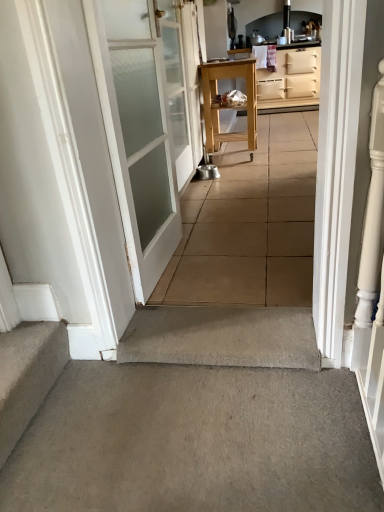
Question: From a real-world perspective, is gray concrete at center over beige matte cabinet at upper right?

Choices:
 (A) yes
 (B) no

Answer: (B)

Question: Is gray concrete at center outside beige matte cabinet at upper right?

Choices:
 (A) no
 (B) yes

Answer: (B)

Question: Is gray concrete at center oriented towards beige matte cabinet at upper right?

Choices:
 (A) no
 (B) yes

Answer: (A)

Question: Is gray concrete at center shorter than beige matte cabinet at upper right?

Choices:
 (A) no
 (B) yes

Answer: (B)

Question: Can you confirm if gray concrete at center is positioned to the left of beige matte cabinet at upper right?

Choices:
 (A) yes
 (B) no

Answer: (A)

Question: From the image's perspective, does gray concrete at center appear lower than beige matte cabinet at upper right?

Choices:
 (A) yes
 (B) no

Answer: (A)

Question: Can you confirm if white frosted glass door at left, marked as the second door in a back-to-front arrangement, is shorter than carpeted stairs at lower left?

Choices:
 (A) yes
 (B) no

Answer: (B)

Question: From the image's perspective, is white frosted glass door at left, acting as the first door starting from the front, on top of carpeted stairs at lower left?

Choices:
 (A) no
 (B) yes

Answer: (B)

Question: Are white frosted glass door at left, marked as the second door in a back-to-front arrangement, and carpeted stairs at lower left making contact?

Choices:
 (A) yes
 (B) no

Answer: (B)

Question: Considering the relative sizes of white frosted glass door at left, acting as the first door starting from the front, and carpeted stairs at lower left in the image provided, is white frosted glass door at left, acting as the first door starting from the front, taller than carpeted stairs at lower left?

Choices:
 (A) yes
 (B) no

Answer: (A)

Question: Is white frosted glass door at left, acting as the first door starting from the front, closer to the viewer compared to carpeted stairs at lower left?

Choices:
 (A) no
 (B) yes

Answer: (A)

Question: Can we say white frosted glass door at left, acting as the first door starting from the front, lies outside carpeted stairs at lower left?

Choices:
 (A) no
 (B) yes

Answer: (B)

Question: Is the position of natural wood table at center more distant than that of gray concrete at center?

Choices:
 (A) yes
 (B) no

Answer: (A)